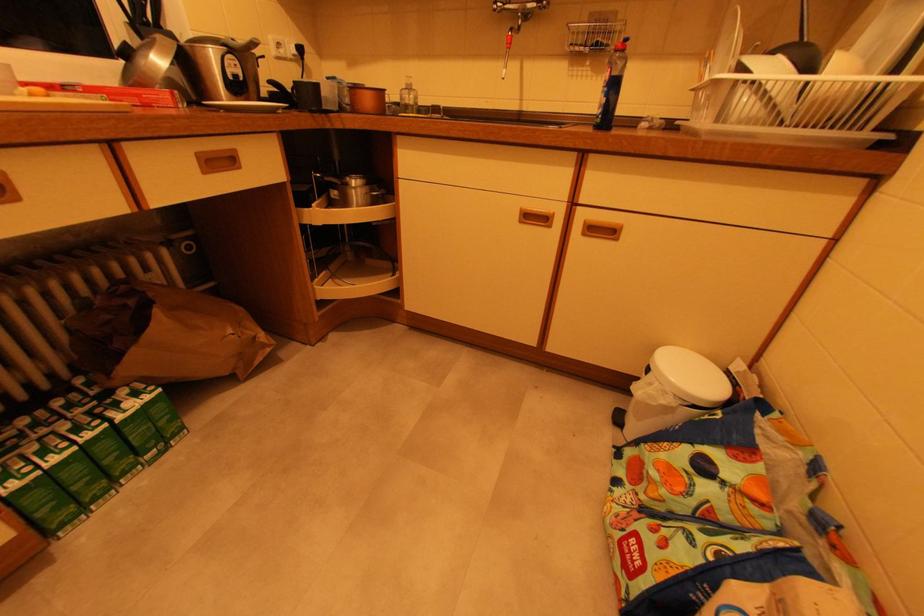
Where is `blue soap bottle`? Image resolution: width=924 pixels, height=616 pixels. blue soap bottle is located at coordinates (612, 86).